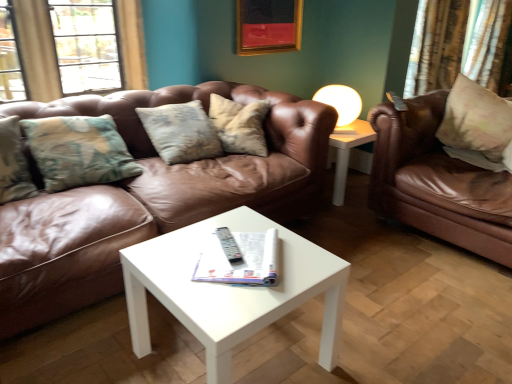
Question: Could you tell me if brown leather couch at center, which is counted as the 2th studio couch, starting from the right, is facing floral fabric pillow at right?

Choices:
 (A) yes
 (B) no

Answer: (B)

Question: From the image's perspective, is brown leather couch at center, the 1th studio couch in the left-to-right sequence, below floral fabric pillow at right?

Choices:
 (A) yes
 (B) no

Answer: (A)

Question: Can you confirm if brown leather couch at center, the 1th studio couch in the left-to-right sequence, is shorter than floral fabric pillow at right?

Choices:
 (A) no
 (B) yes

Answer: (A)

Question: Does brown leather couch at center, which is counted as the 2th studio couch, starting from the right, have a larger size compared to floral fabric pillow at right?

Choices:
 (A) no
 (B) yes

Answer: (B)

Question: Is brown leather couch at center, which is counted as the 2th studio couch, starting from the right, far from floral fabric pillow at right?

Choices:
 (A) yes
 (B) no

Answer: (A)

Question: Is floral fabric pillow at right bigger or smaller than white paper magazine at center?

Choices:
 (A) small
 (B) big

Answer: (B)

Question: Considering the positions of floral fabric pillow at right and white paper magazine at center in the image, is floral fabric pillow at right taller or shorter than white paper magazine at center?

Choices:
 (A) short
 (B) tall

Answer: (B)

Question: From a real-world perspective, is floral fabric pillow at right physically located above or below white paper magazine at center?

Choices:
 (A) below
 (B) above

Answer: (B)

Question: Do you think floral fabric pillow at right is within white paper magazine at center, or outside of it?

Choices:
 (A) outside
 (B) inside

Answer: (A)

Question: Based on their positions, is white matte lampshade at upper center located to the left or right of floral fabric pillow at right?

Choices:
 (A) left
 (B) right

Answer: (A)

Question: In terms of height, does white matte lampshade at upper center look taller or shorter compared to floral fabric pillow at right?

Choices:
 (A) short
 (B) tall

Answer: (A)

Question: From a real-world perspective, relative to floral fabric pillow at right, is white matte lampshade at upper center vertically above or below?

Choices:
 (A) above
 (B) below

Answer: (B)

Question: Considering the positions of white matte lampshade at upper center and floral fabric pillow at right in the image, is white matte lampshade at upper center wider or thinner than floral fabric pillow at right?

Choices:
 (A) thin
 (B) wide

Answer: (A)

Question: Do you think brown leather couch at center, which is counted as the 2th studio couch, starting from the right, is within white matte lampshade at upper center, or outside of it?

Choices:
 (A) inside
 (B) outside

Answer: (B)

Question: From a real-world perspective, is brown leather couch at center, which is counted as the 2th studio couch, starting from the right, positioned above or below white matte lampshade at upper center?

Choices:
 (A) below
 (B) above

Answer: (A)